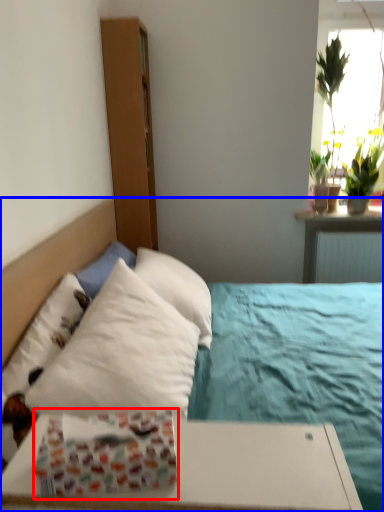
Question: Which point is closer to the camera, gift wrap (highlighted by a red box) or bed (highlighted by a blue box)?

Choices:
 (A) gift wrap
 (B) bed

Answer: (A)